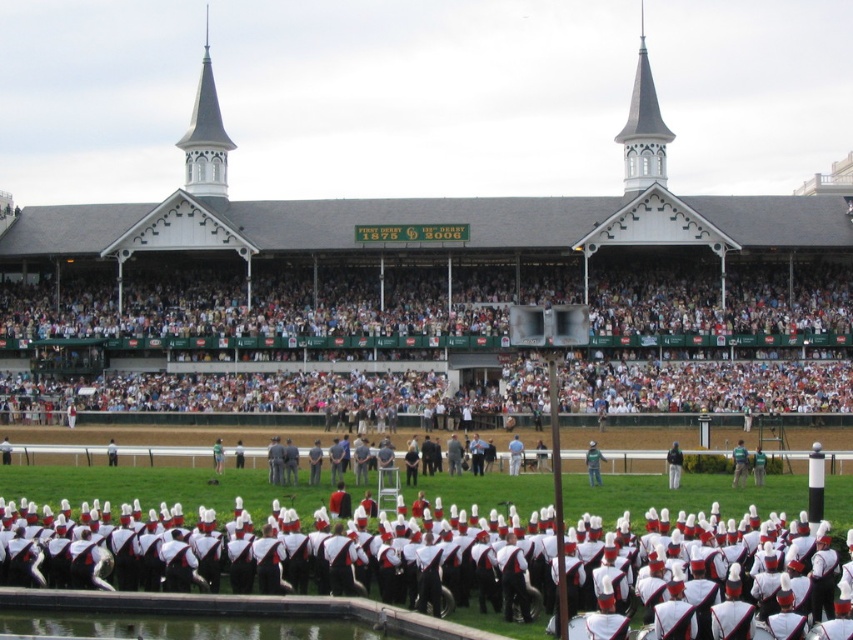
Looking at this image, is white wood spire at upper center wider than green fabric jacket at center?

Yes.

Is white wood spire at upper center above green fabric jacket at center?

Yes, white wood spire at upper center is above green fabric jacket at center.

The image size is (853, 640). What do you see at coordinates (643, 129) in the screenshot?
I see `white wood spire at upper center` at bounding box center [643, 129].

At what (x,y) coordinates should I click in order to perform the action: click on white wood spire at upper center. Please return your answer as a coordinate pair (x, y). The height and width of the screenshot is (640, 853). Looking at the image, I should click on (643, 129).

Can you confirm if white matte uniform at lower center is positioned above black leather jacket at center?

No.

Can you confirm if white matte uniform at lower center is positioned below black leather jacket at center?

Indeed, white matte uniform at lower center is positioned under black leather jacket at center.

Between point (637, 609) and point (666, 467), which one is positioned in front?

Point (637, 609) is in front.

Find the location of `white matte uniform at lower center`. white matte uniform at lower center is located at coordinates (322, 548).

Is white cotton crowd at center positioned at the back of black leather jacket at center?

Yes.

Can you confirm if white cotton crowd at center is smaller than black leather jacket at center?

No, white cotton crowd at center is not smaller than black leather jacket at center.

Between point (347, 380) and point (679, 467), which one is positioned in front?

Point (679, 467) is more forward.

I want to click on white cotton crowd at center, so click(x=259, y=349).